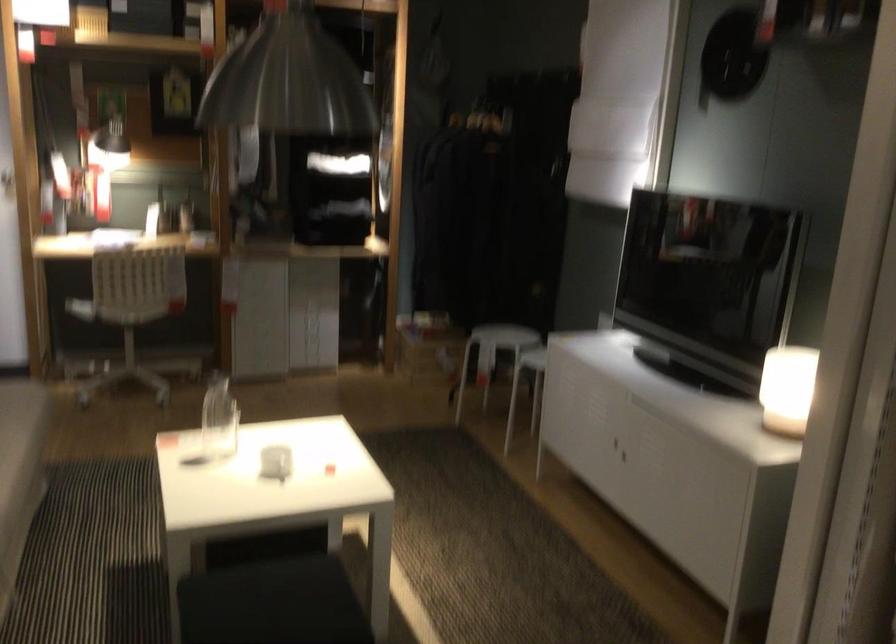
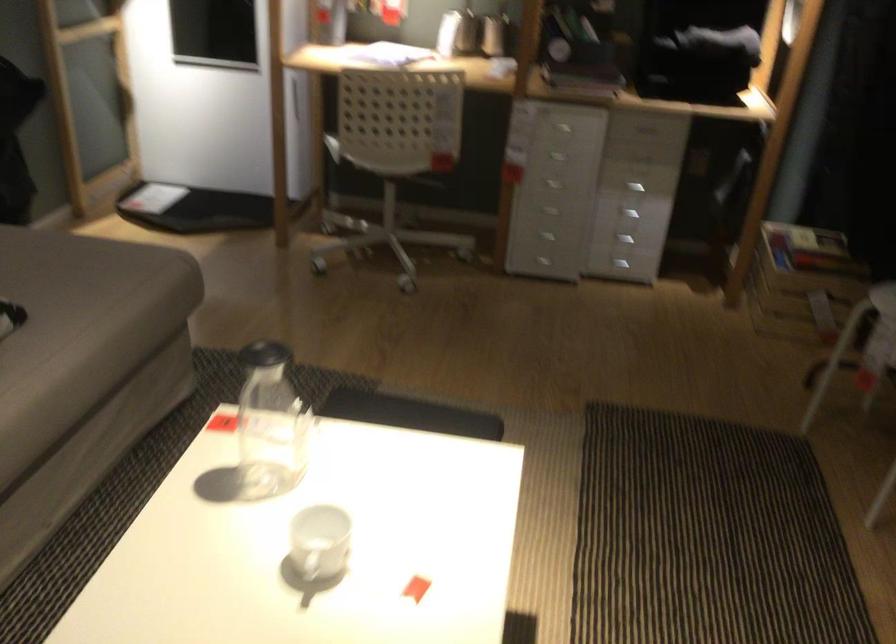
The point at (195,446) is marked in the first image. Where is the corresponding point in the second image?

(270, 424)